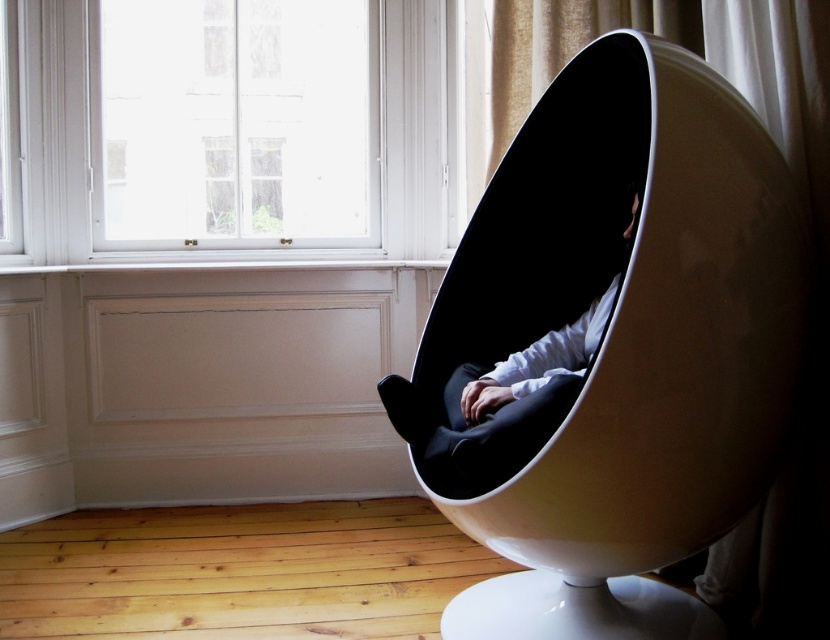
You are an interior designer planning to place a new sofa in this room. The sofa will be positioned between the transparent glass window at upper center and the matte black egg chair at center. Given that the sofa requires at least 1.2 meters of space to fit comfortably, can you determine if there is enough space between these two objects?

The transparent glass window at upper center is bigger than the matte black egg chair at center, but the description does not provide specific measurements of the distance between them. Therefore, it is impossible to determine if there is enough space for the sofa based on the given information.

You are standing in the room and want to determine which of the two points, point (692, 83) or point (143, 154), is closer to you. Based on the description, which point is nearer?

Point (692, 83) is closer to the camera than point (143, 154), so it is the nearer point.

You are standing in the room and want to move from point A to point B. Point A is at coordinates point (133, 22) and point B is at coordinates point (510, 385). Which point is closer to you?

Point (133, 22) is closer to you because it is further to the viewer than point (510, 385).